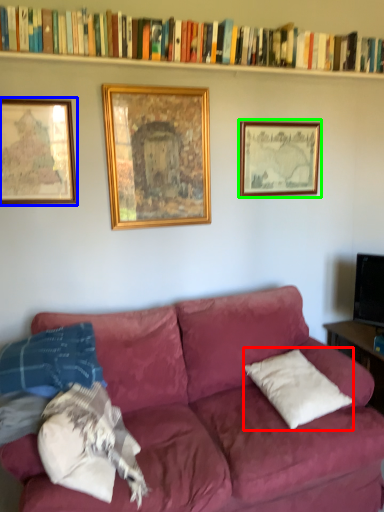
Question: Which is nearer to the pillow (highlighted by a red box)? picture frame (highlighted by a blue box) or picture frame (highlighted by a green box).

Choices:
 (A) picture frame
 (B) picture frame

Answer: (B)